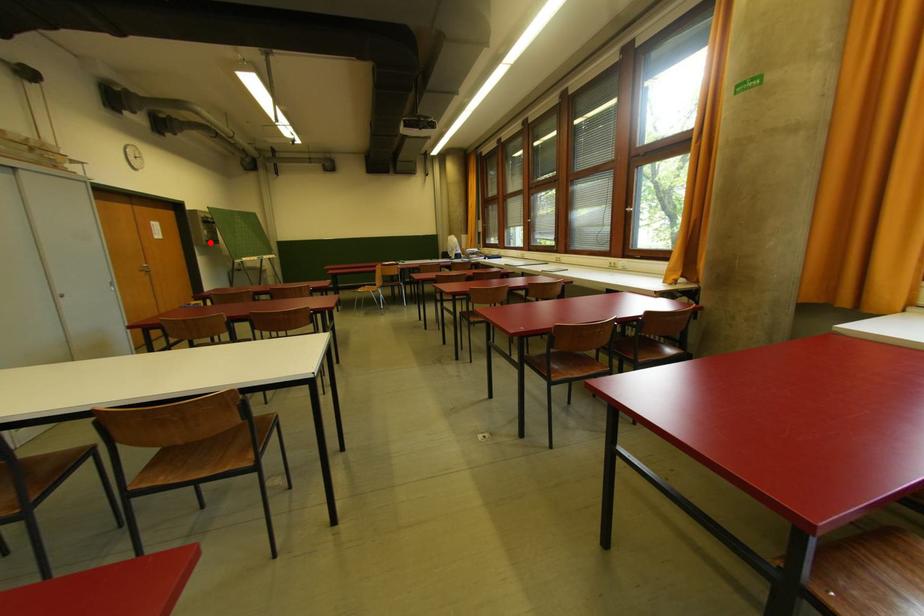
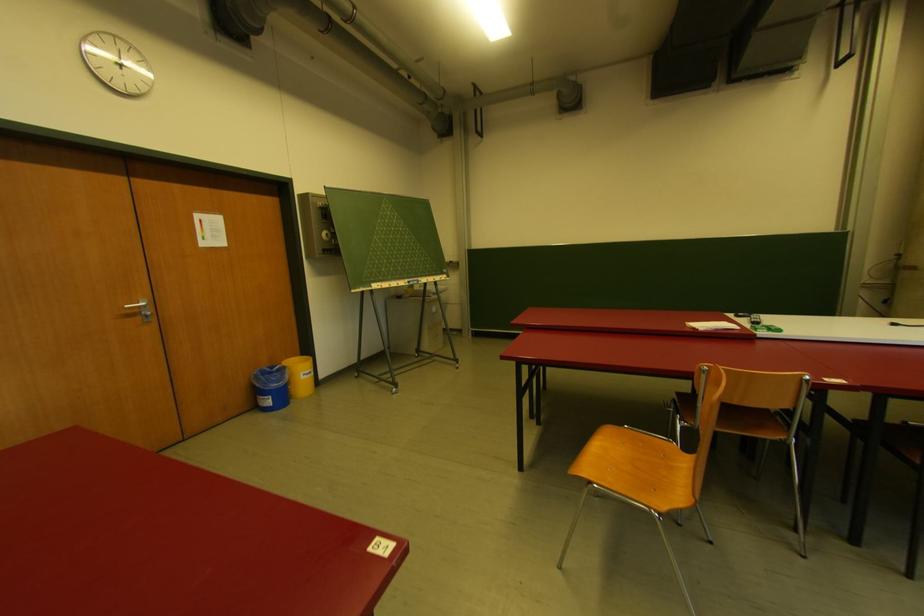
Find the pixel in the second image that matches the highlighted location in the first image.

(326, 252)